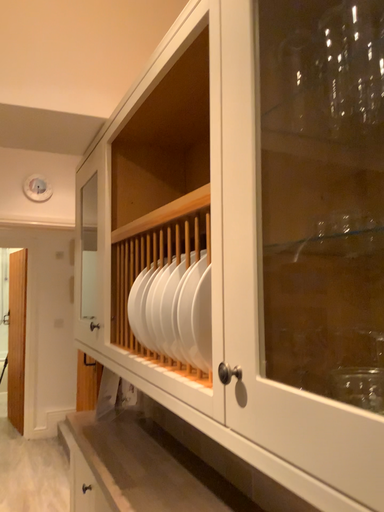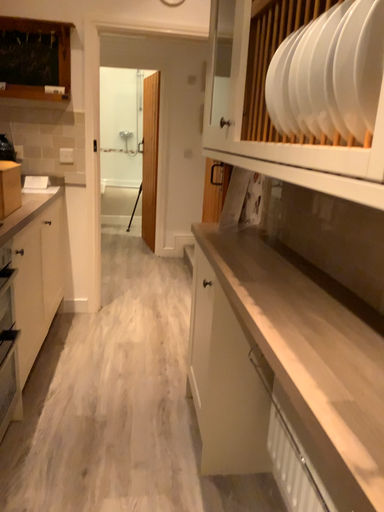
Question: How did the camera likely rotate when shooting the video?

Choices:
 (A) rotated right
 (B) rotated left

Answer: (B)